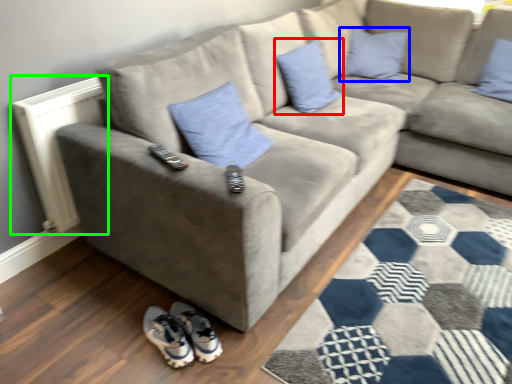
Question: Considering the real-world distances, which object is closest to pillow (highlighted by a red box)? pillow (highlighted by a blue box) or radiator (highlighted by a green box).

Choices:
 (A) pillow
 (B) radiator

Answer: (A)